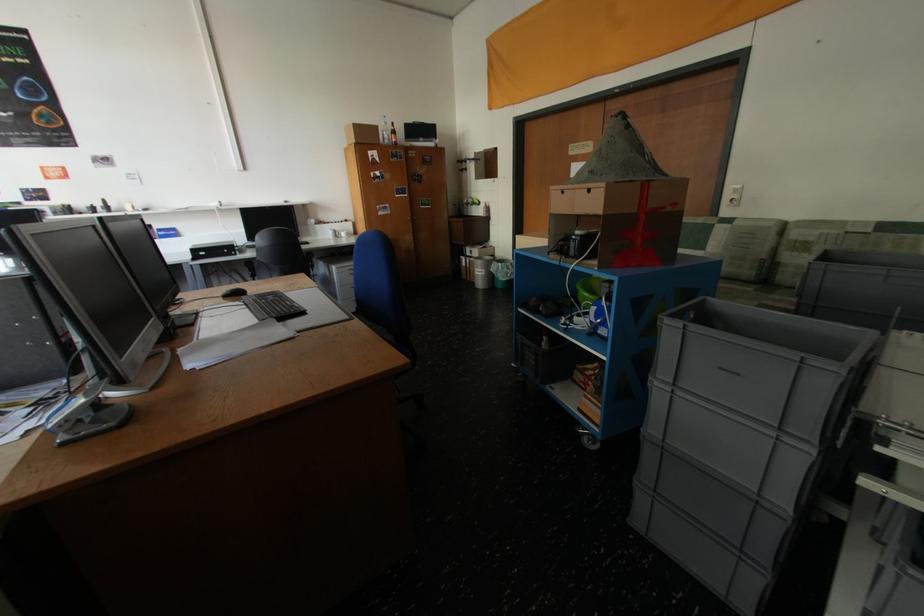
Locate an element on the screen. black keyboard is located at coordinates (274, 306).